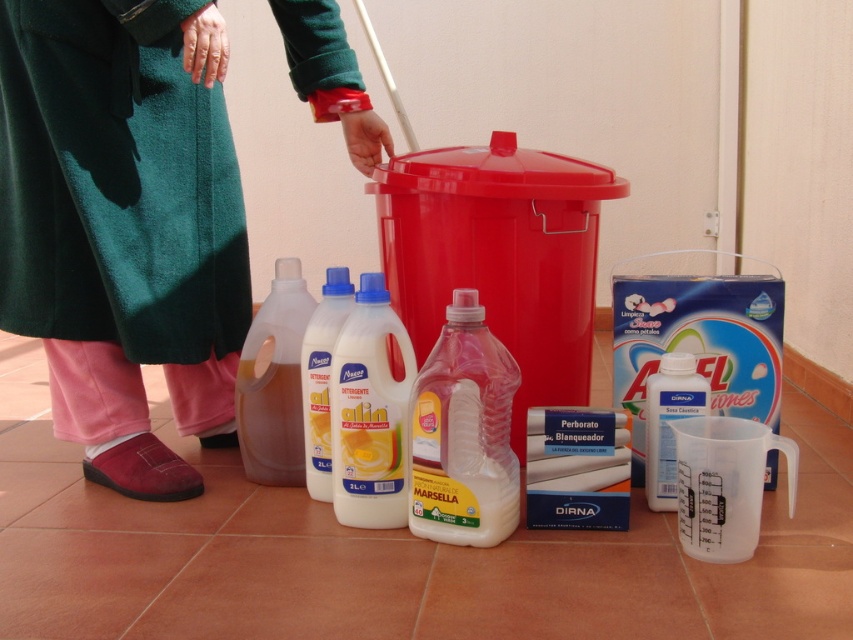
Who is shorter, pink translucent bottle at center or white plastic bottles at center?

pink translucent bottle at center is shorter.

Where is `pink translucent bottle at center`? This screenshot has height=640, width=853. pink translucent bottle at center is located at coordinates (463, 433).

The width and height of the screenshot is (853, 640). Find the location of `pink translucent bottle at center`. pink translucent bottle at center is located at coordinates (463, 433).

Can you confirm if white plastic bottle at center is thinner than transparent plastic bottle at lower right?

Incorrect, white plastic bottle at center's width is not less than transparent plastic bottle at lower right's.

Is point (352, 328) closer to camera compared to point (648, 468)?

Yes, it is in front of point (648, 468).

The image size is (853, 640). In order to click on white plastic bottle at center in this screenshot , I will do `click(369, 412)`.

Who is lower down, translucent plastic bottle at lower left or transparent plastic bottle at lower right?

transparent plastic bottle at lower right is below.

Who is shorter, translucent plastic bottle at lower left or transparent plastic bottle at lower right?

Standing shorter between the two is transparent plastic bottle at lower right.

Who is more forward, (268, 353) or (656, 428)?

Positioned in front is point (656, 428).

Locate an element on the screen. This screenshot has width=853, height=640. translucent plastic bottle at lower left is located at coordinates (274, 381).